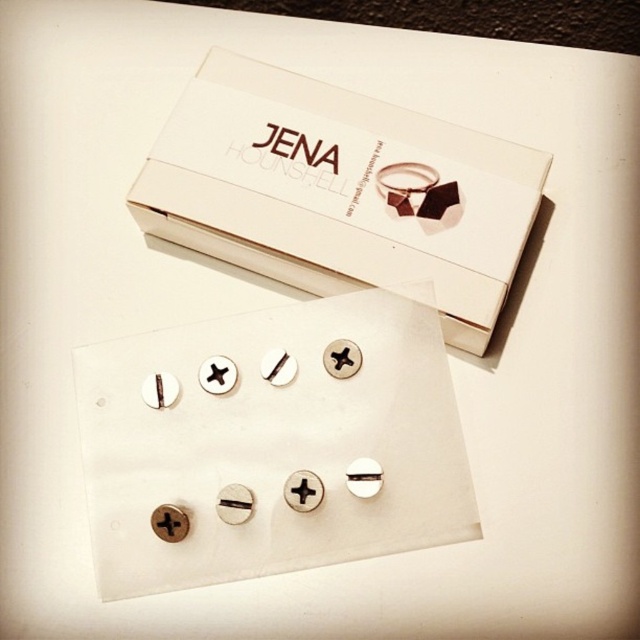
This screenshot has width=640, height=640. Identify the location of silver metallic screws at center. (272, 444).

Does silver metallic screws at center have a lesser width compared to white cardboard box at upper center?

Yes, silver metallic screws at center is thinner than white cardboard box at upper center.

The image size is (640, 640). In order to click on silver metallic screws at center in this screenshot , I will do `click(272, 444)`.

At what (x,y) coordinates should I click in order to perform the action: click on silver metallic screws at center. Please return your answer as a coordinate pair (x, y). Looking at the image, I should click on (272, 444).